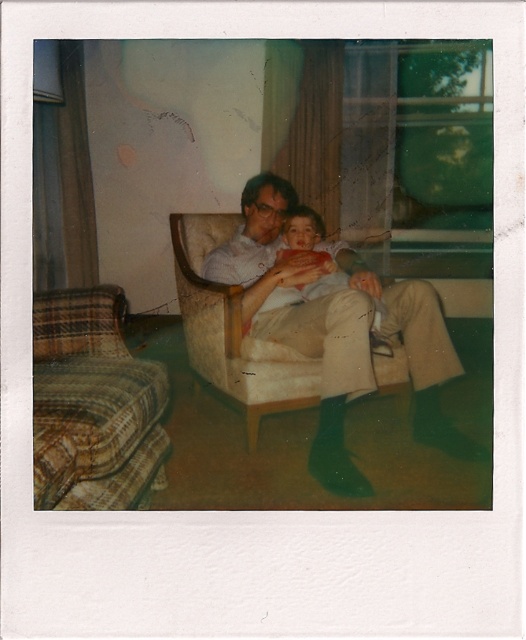
Question: Does light brown fabric chair at center appear over smooth red shirt at center?

Choices:
 (A) yes
 (B) no

Answer: (B)

Question: Does light brown fabric chair at center appear over smooth red shirt at center?

Choices:
 (A) yes
 (B) no

Answer: (B)

Question: Which point is closer to the camera taking this photo?

Choices:
 (A) click(x=319, y=429)
 (B) click(x=331, y=266)

Answer: (A)

Question: Is light brown fabric chair at center below smooth red shirt at center?

Choices:
 (A) yes
 (B) no

Answer: (A)

Question: Which point is farther from the camera taking this photo?

Choices:
 (A) pos(311,221)
 (B) pos(298,332)

Answer: (A)

Question: Which point is closer to the camera?

Choices:
 (A) (402, 308)
 (B) (294, 221)

Answer: (A)